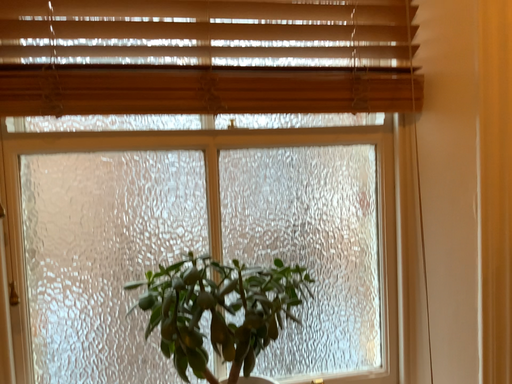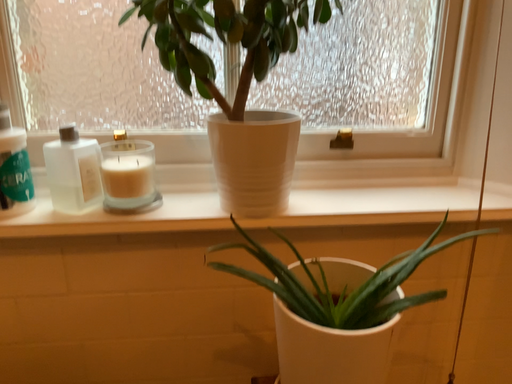
Question: Which way did the camera rotate in the video?

Choices:
 (A) rotated downward
 (B) rotated upward

Answer: (A)